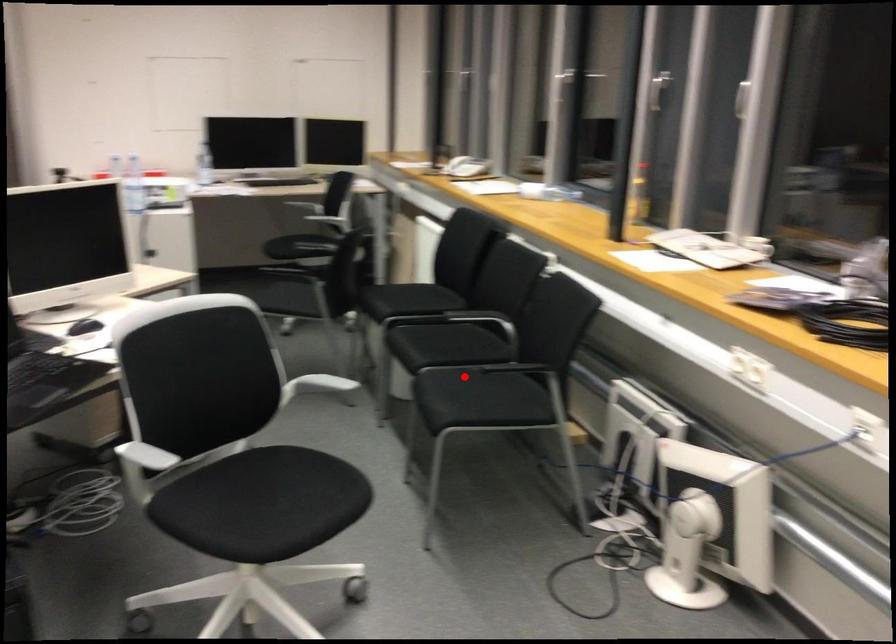
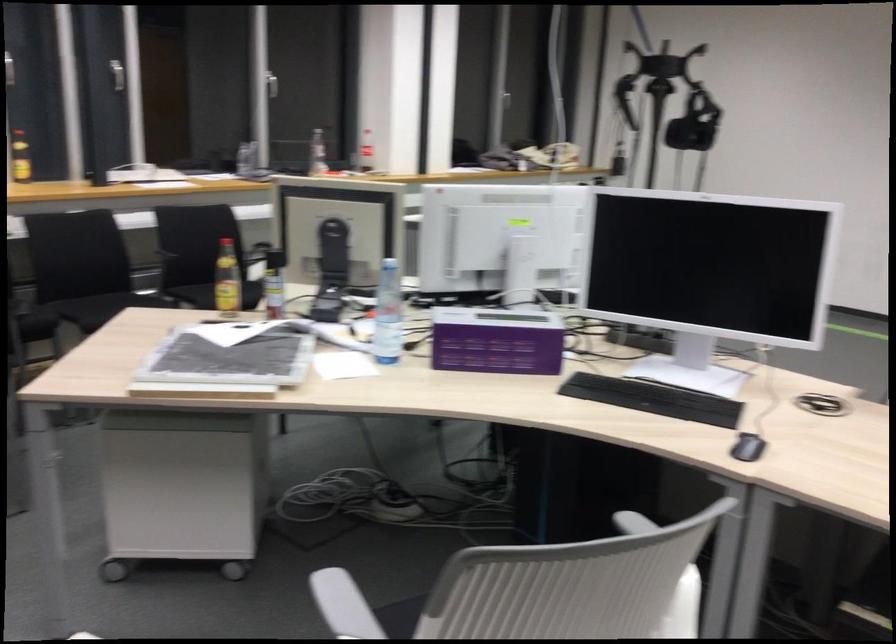
Question: I am providing you with two images of the same scene from different viewpoints. A red point is marked on the first image. Can you still see the location of the red point in image 2?

Choices:
 (A) Yes
 (B) No

Answer: (A)